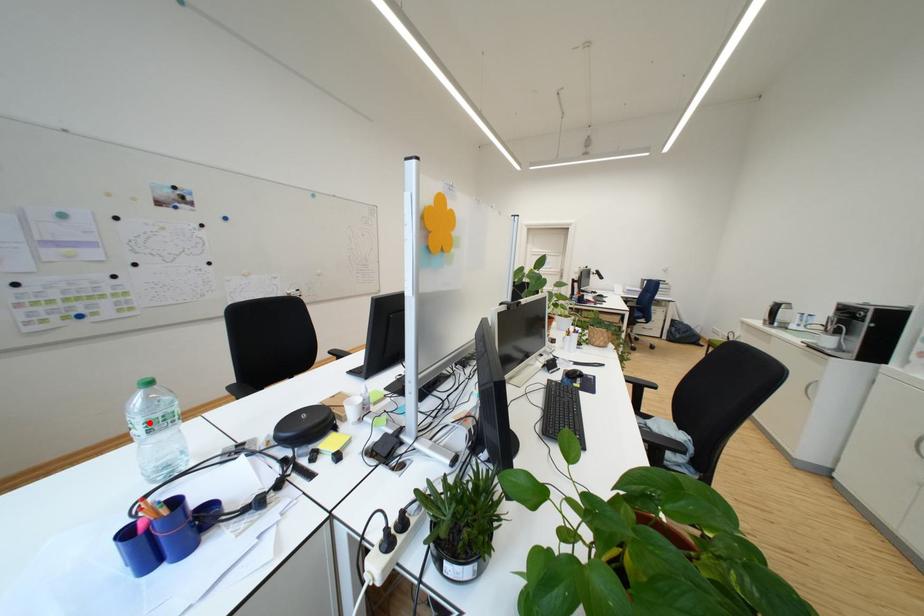
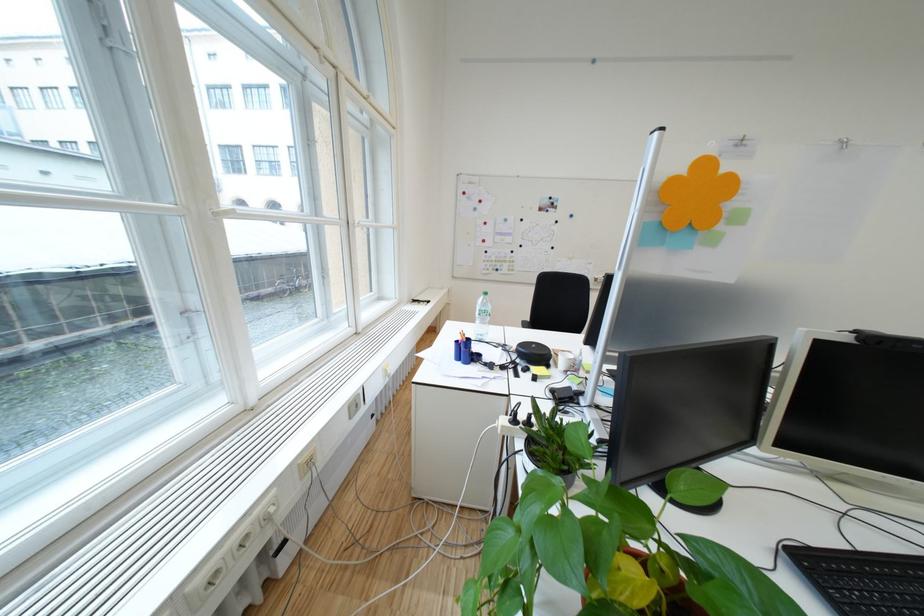
Where in the second image is the point corresponding to the highlighted location from the first image?

(490, 310)